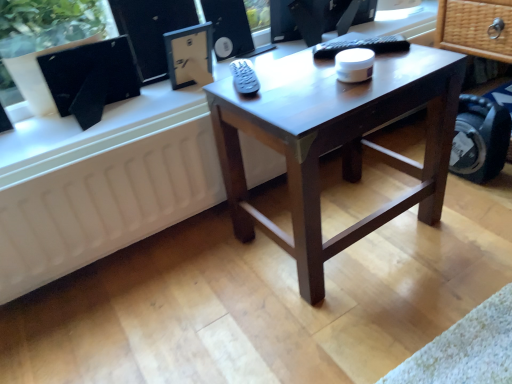
Locate an element on the screen. Image resolution: width=512 pixels, height=384 pixels. vacant space underneath black matte computer monitor at upper left (from a real-world perspective) is located at coordinates (x=114, y=112).